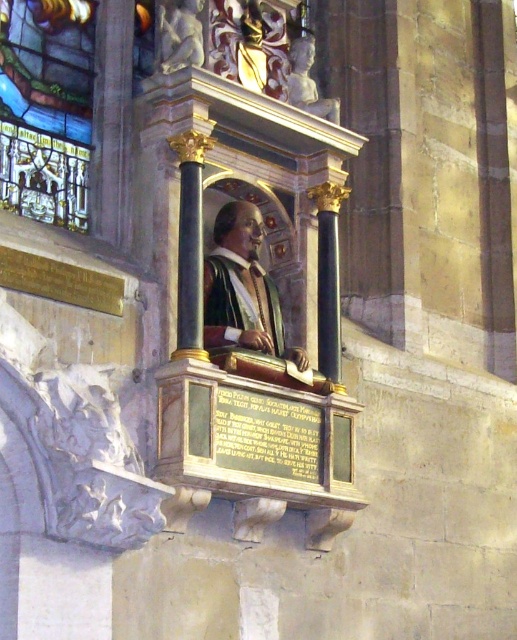
From the picture: You are an art conservator assessing the monument. You need to determine which object is taller between the matte gold robe at center and the polished marble cherub at upper left. Based on the monument layout, which one is taller?

The matte gold robe at center is taller than the polished marble cherub at upper left according to the description.

You are an art historian examining the monument and its surroundings. From your vantage point, does the stained glass window at upper left appear higher or lower than the matte gold statue at center?

The stained glass window at upper left is above the matte gold statue at center, so it appears higher.